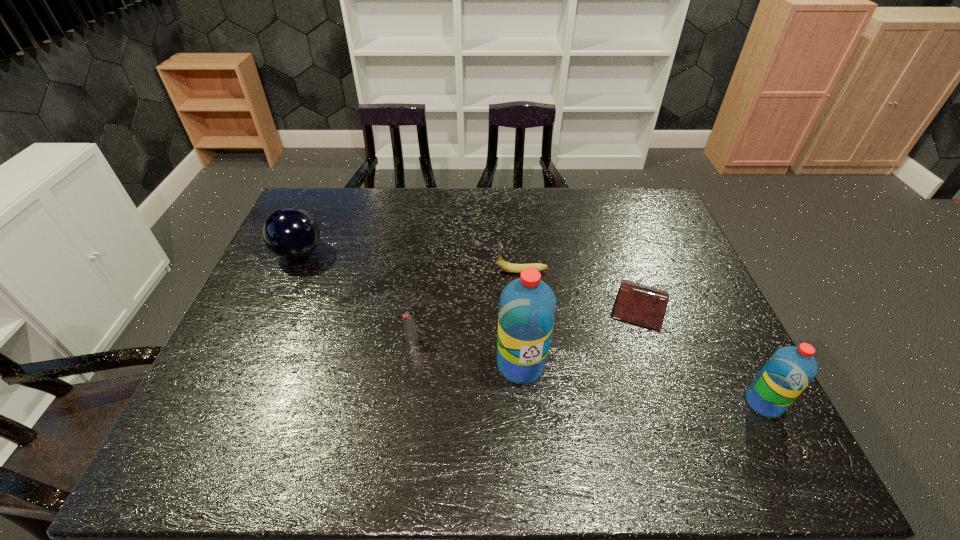
Identify the location of free spot that satisfies the following two spatial constraints: 1. on the side of the fourth nearest object with the finger holes; 2. on the left side of the leftmost object. This screenshot has height=540, width=960. (276, 305).

Where is `free space in the image that satisfies the following two spatial constraints: 1. at the stem of the banana; 2. on the front label of the farther water bottle`? free space in the image that satisfies the following two spatial constraints: 1. at the stem of the banana; 2. on the front label of the farther water bottle is located at coordinates (532, 364).

You are a GUI agent. You are given a task and a screenshot of the screen. Output one action in this format:
    pyautogui.click(x=<x>, y=<y>)
    Task: Click on the free spot that satisfies the following two spatial constraints: 1. at the stem of the banana; 2. on the front label of the left water bottle
    Image resolution: width=960 pixels, height=540 pixels.
    Given the screenshot: What is the action you would take?
    pyautogui.click(x=532, y=364)

What are the coordinates of `vacant position in the image that satisfies the following two spatial constraints: 1. on the back side of the second object from right to left; 2. at the stem of the banana` in the screenshot? It's located at (x=629, y=271).